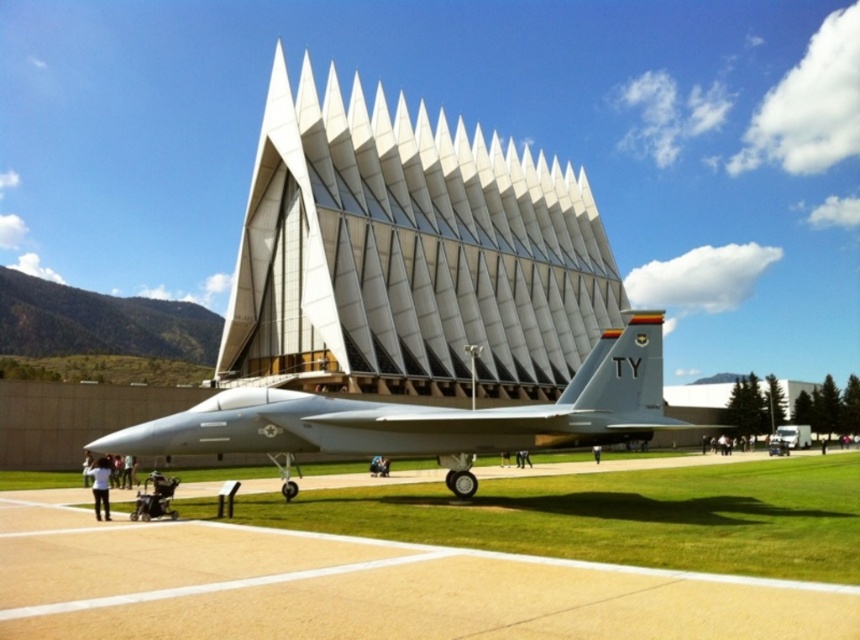
Question: Can you confirm if white matte building at center is smaller than silver metallic jet at center?

Choices:
 (A) no
 (B) yes

Answer: (A)

Question: Which is nearer to the silver metallic jet at center?

Choices:
 (A) white fabric shirt at lower left
 (B) white matte building at center

Answer: (A)

Question: Which object appears closest to the camera in this image?

Choices:
 (A) white fabric shirt at lower left
 (B) white matte building at center
 (C) smooth concrete tarmac at center

Answer: (C)

Question: Can you confirm if silver metallic jet at center is positioned to the right of white fabric shirt at lower left?

Choices:
 (A) yes
 (B) no

Answer: (B)

Question: Does white matte building at center have a greater width compared to white fabric shirt at lower left?

Choices:
 (A) yes
 (B) no

Answer: (A)

Question: Which point is farther to the camera?

Choices:
 (A) white fabric shirt at lower left
 (B) white matte building at center
 (C) silver metallic jet at center
 (D) smooth concrete tarmac at center

Answer: (B)